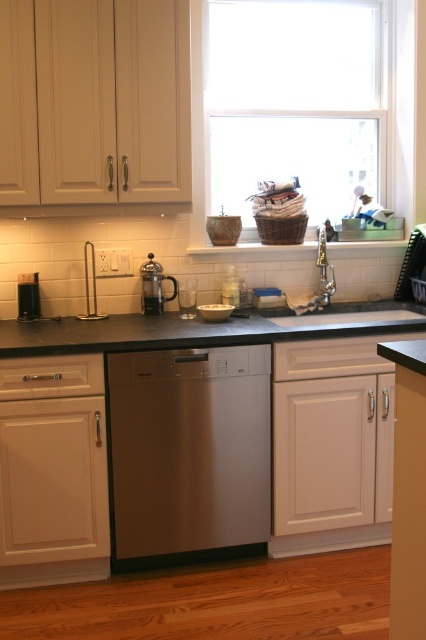
Question: Among these points, which one is farthest from the camera?

Choices:
 (A) (203, 410)
 (B) (157, 291)
 (C) (287, 320)
 (D) (362, 42)

Answer: (D)

Question: From the image, what is the correct spatial relationship of white matte window at upper center in relation to satin silver french press at center?

Choices:
 (A) below
 (B) above

Answer: (B)

Question: Can you confirm if stainless steel dishwasher at center is positioned to the right of black granite countertop at center?

Choices:
 (A) yes
 (B) no

Answer: (B)

Question: Which point is closer to the camera taking this photo?

Choices:
 (A) (330, 49)
 (B) (363, 332)

Answer: (B)

Question: Does black granite countertop at center appear on the left side of white porcelain sink at center?

Choices:
 (A) yes
 (B) no

Answer: (A)

Question: Which object is farther from the camera taking this photo?

Choices:
 (A) satin silver french press at center
 (B) black granite countertop at center
 (C) white porcelain sink at center
 (D) white matte window at upper center

Answer: (A)